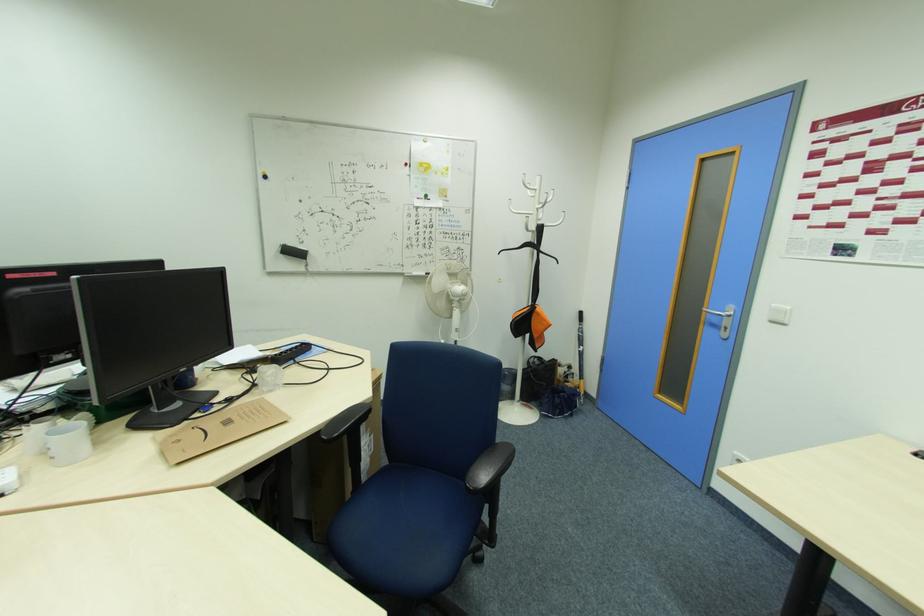
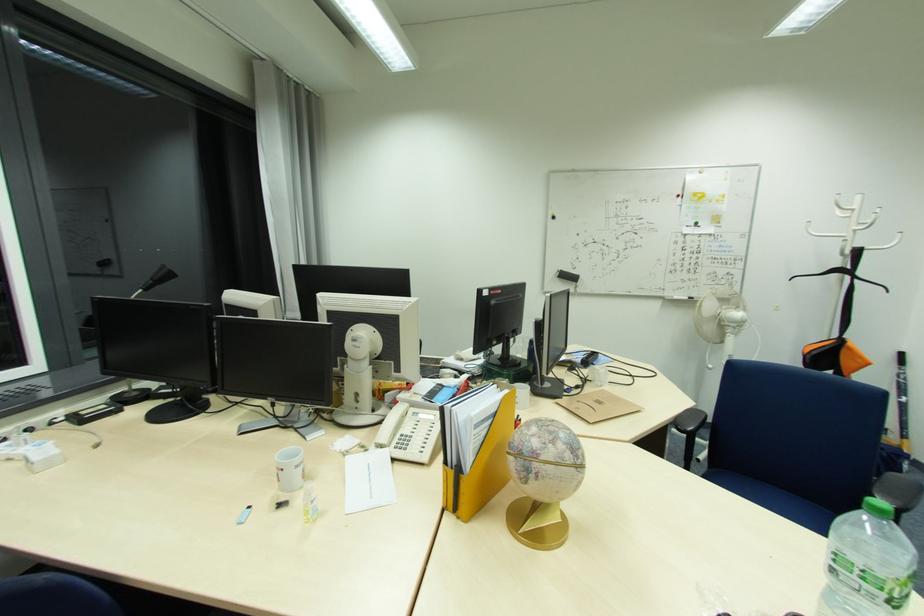
Question: The images are taken continuously from a first-person perspective. In which direction is your viewpoint rotating?

Choices:
 (A) Left
 (B) Right
 (C) Up
 (D) Down

Answer: (A)